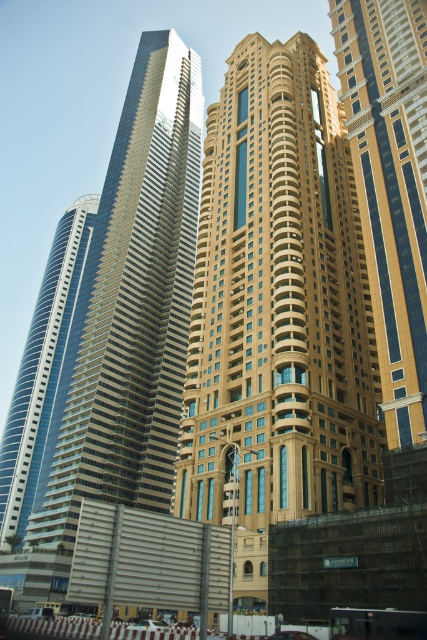
Question: Is shiny glass skyscraper at center closer to camera compared to shiny blue glass skyscraper at left?

Choices:
 (A) no
 (B) yes

Answer: (B)

Question: Which object is closer to the camera taking this photo?

Choices:
 (A) shiny glass skyscraper at center
 (B) shiny blue glass skyscraper at left
 (C) gold/beige stone building at center

Answer: (C)

Question: Which is farther from the shiny blue glass skyscraper at left?

Choices:
 (A) shiny glass skyscraper at center
 (B) golden stone building at center

Answer: (B)

Question: Observing the image, what is the correct spatial positioning of golden stone building at center in reference to shiny glass skyscraper at center?

Choices:
 (A) below
 (B) above

Answer: (A)

Question: Can you confirm if golden stone building at center is positioned below shiny blue glass skyscraper at left?

Choices:
 (A) no
 (B) yes

Answer: (B)

Question: Which object is the farthest from the shiny blue glass skyscraper at left?

Choices:
 (A) gold/beige stone building at center
 (B) golden stone building at center
 (C) shiny glass skyscraper at center

Answer: (A)